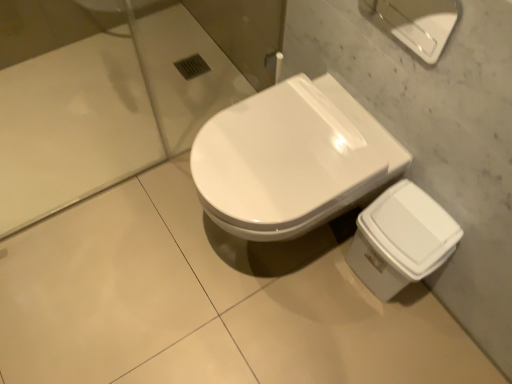
Question: Considering the relative sizes of white glossy toilet at center and white glossy trash can at lower right, the 1th porcelain from the bottom, in the image provided, is white glossy toilet at center smaller than white glossy trash can at lower right, the 1th porcelain from the bottom,?

Choices:
 (A) no
 (B) yes

Answer: (A)

Question: From the image's perspective, would you say white glossy toilet at center is shown under white glossy trash can at lower right, which is the 2th porcelain in front-to-back order?

Choices:
 (A) yes
 (B) no

Answer: (B)

Question: Is white glossy toilet at center wider than white glossy trash can at lower right, the second porcelain viewed from the top?

Choices:
 (A) yes
 (B) no

Answer: (A)

Question: Is white glossy trash can at lower right, the 1th porcelain from the bottom, located within white glossy toilet at center?

Choices:
 (A) yes
 (B) no

Answer: (B)

Question: Considering the relative positions of white glossy toilet at center and white glossy trash can at lower right, the second porcelain viewed from the top, in the image provided, is white glossy toilet at center to the left of white glossy trash can at lower right, the second porcelain viewed from the top, from the viewer's perspective?

Choices:
 (A) yes
 (B) no

Answer: (A)

Question: Relative to white glossy toilet at center, is white glossy porcelain at upper right, which is the second porcelain in back-to-front order, in front or behind?

Choices:
 (A) behind
 (B) front

Answer: (B)

Question: Considering the positions of white glossy porcelain at upper right, the first porcelain when ordered from top to bottom, and white glossy toilet at center in the image, is white glossy porcelain at upper right, the first porcelain when ordered from top to bottom, taller or shorter than white glossy toilet at center?

Choices:
 (A) short
 (B) tall

Answer: (A)

Question: Is white glossy porcelain at upper right, which is the second porcelain from bottom to top, bigger or smaller than white glossy toilet at center?

Choices:
 (A) big
 (B) small

Answer: (B)

Question: From a real-world perspective, relative to white glossy toilet at center, is white glossy porcelain at upper right, the first porcelain when ordered from top to bottom, vertically above or below?

Choices:
 (A) above
 (B) below

Answer: (A)

Question: Looking at the image, does white glossy toilet at center seem bigger or smaller compared to white glossy porcelain at upper right, which is the second porcelain in back-to-front order?

Choices:
 (A) small
 (B) big

Answer: (B)

Question: From the image's perspective, is white glossy toilet at center positioned above or below white glossy porcelain at upper right, the first porcelain when ordered from top to bottom?

Choices:
 (A) above
 (B) below

Answer: (B)

Question: From a real-world perspective, is white glossy toilet at center above or below white glossy porcelain at upper right, the first porcelain when ordered from top to bottom?

Choices:
 (A) above
 (B) below

Answer: (B)

Question: Does point (312, 208) appear closer or farther from the camera than point (420, 29)?

Choices:
 (A) farther
 (B) closer

Answer: (B)

Question: Considering the positions of white glossy trash can at lower right, the 1th porcelain from the bottom, and white glossy porcelain at upper right, which is the second porcelain from bottom to top, in the image, is white glossy trash can at lower right, the 1th porcelain from the bottom, wider or thinner than white glossy porcelain at upper right, which is the second porcelain from bottom to top,?

Choices:
 (A) thin
 (B) wide

Answer: (B)

Question: In terms of height, does white glossy trash can at lower right, the second porcelain viewed from the top, look taller or shorter compared to white glossy porcelain at upper right, which is the second porcelain in back-to-front order?

Choices:
 (A) tall
 (B) short

Answer: (A)